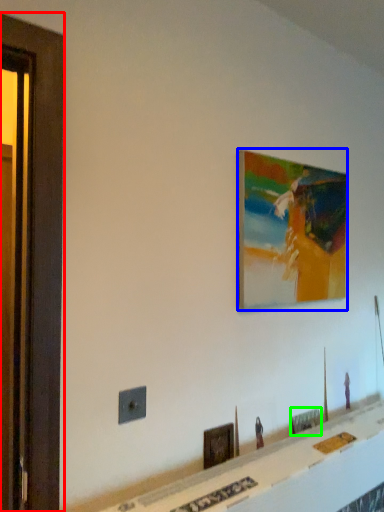
Question: Based on their relative distances, which object is nearer to screen door (highlighted by a red box)? Choose from picture frame (highlighted by a blue box) and picture frame (highlighted by a green box).

Choices:
 (A) picture frame
 (B) picture frame

Answer: (A)